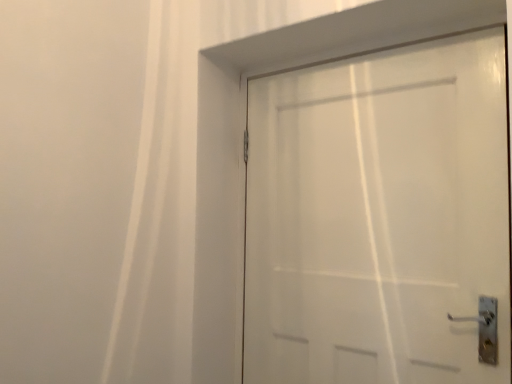
The width and height of the screenshot is (512, 384). Describe the element at coordinates (379, 217) in the screenshot. I see `white glossy door at center` at that location.

Locate an element on the screen. The height and width of the screenshot is (384, 512). white glossy door at center is located at coordinates (379, 217).

At what (x,y) coordinates should I click in order to perform the action: click on white glossy door at center. Please return your answer as a coordinate pair (x, y). Image resolution: width=512 pixels, height=384 pixels. Looking at the image, I should click on (379, 217).